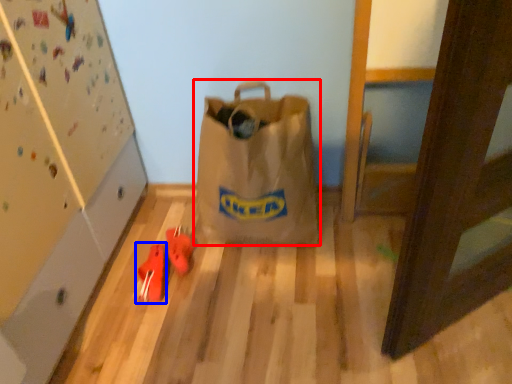
Question: Among these objects, which one is farthest to the camera, luggage and bags (highlighted by a red box) or footwear (highlighted by a blue box)?

Choices:
 (A) luggage and bags
 (B) footwear

Answer: (B)